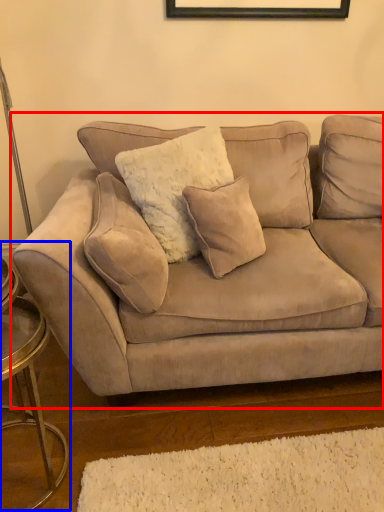
Question: Among these objects, which one is nearest to the camera, studio couch (highlighted by a red box) or side table (highlighted by a blue box)?

Choices:
 (A) studio couch
 (B) side table

Answer: (B)